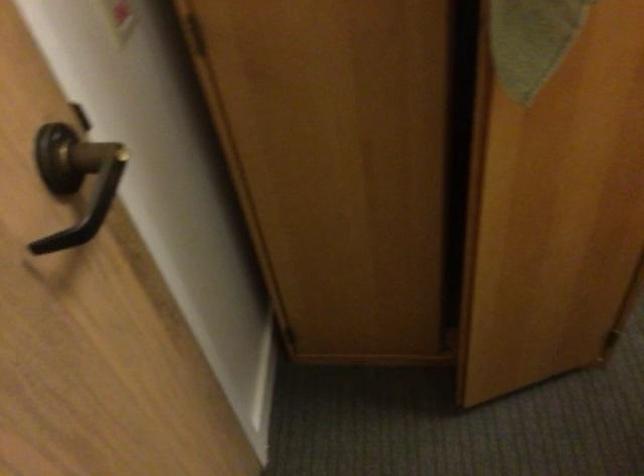
Locate an element on the screen. black door handle is located at coordinates (89, 194).